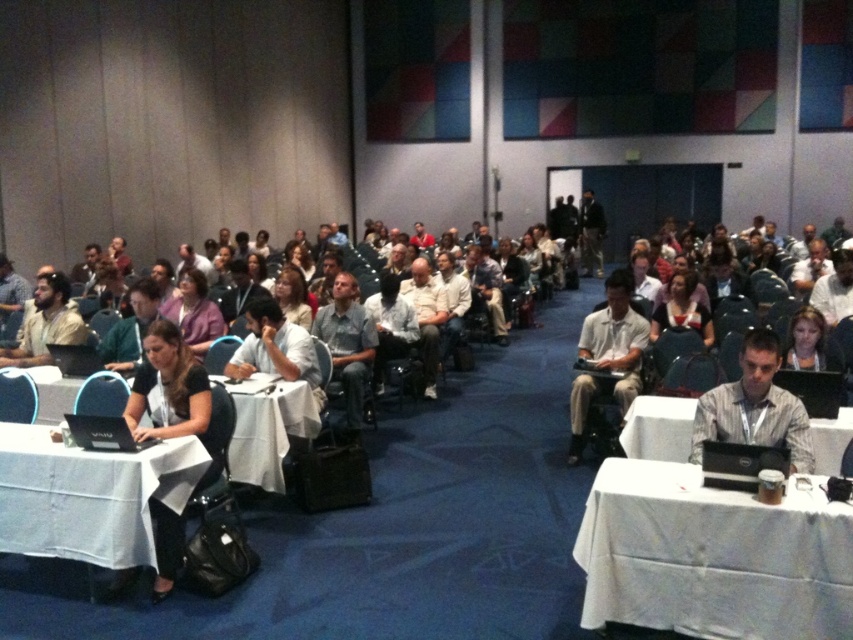
Does white cloth table at center have a lesser height compared to matte purple shirt at center?

Correct, white cloth table at center is not as tall as matte purple shirt at center.

Between white cloth table at center and matte purple shirt at center, which one is positioned higher?

matte purple shirt at center

Which is in front, point (293, 433) or point (190, 269)?

Positioned in front is point (293, 433).

At what (x,y) coordinates should I click in order to perform the action: click on white cloth table at center. Please return your answer as a coordinate pair (x, y). Looking at the image, I should click on (270, 433).

Can you confirm if light gray striped shirt at center is thinner than matte purple shirt at center?

Indeed, light gray striped shirt at center has a lesser width compared to matte purple shirt at center.

Between light gray striped shirt at center and matte purple shirt at center, which one is positioned lower?

light gray striped shirt at center

Identify the location of light gray striped shirt at center. Image resolution: width=853 pixels, height=640 pixels. (753, 406).

Can you confirm if white fabric laptop at center is thinner than black matte laptop at lower left?

Incorrect, white fabric laptop at center's width is not less than black matte laptop at lower left's.

In the scene shown: Is the position of white fabric laptop at center less distant than that of black matte laptop at lower left?

No, it is not.

Who is more distant from viewer, (637,339) or (112,422)?

Point (637,339)

This screenshot has width=853, height=640. What are the coordinates of `white fabric laptop at center` in the screenshot? It's located at (616, 339).